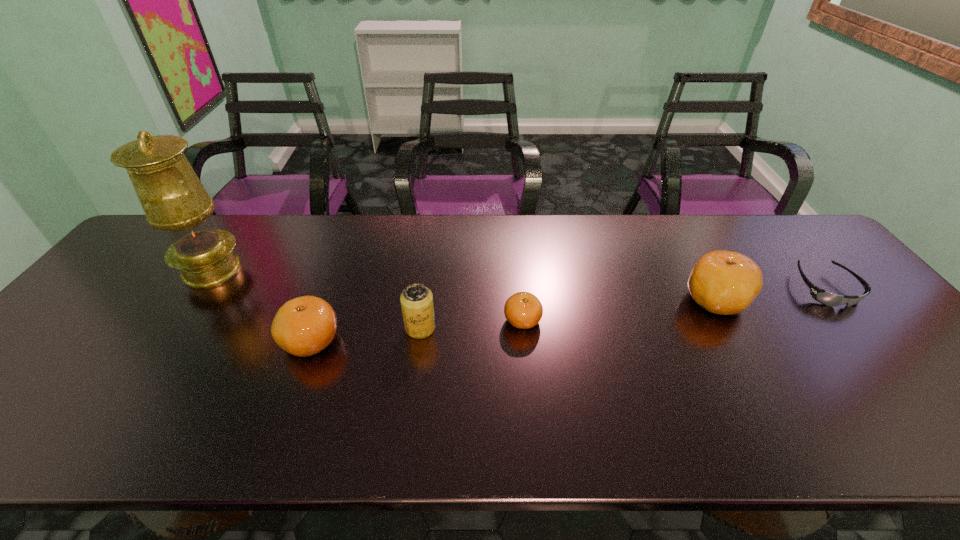
Where is `blank region between the rightmost clementine and the second clementine from left to right`? blank region between the rightmost clementine and the second clementine from left to right is located at coordinates (619, 310).

Locate which object is the fifth closest to the oil lamp. Please provide its 2D coordinates. Your answer should be formatted as a tuple, i.e. [(x, y)], where the tuple contains the x and y coordinates of a point satisfying the conditions above.

[(822, 296)]

The width and height of the screenshot is (960, 540). I want to click on object that is the fourth closest one to the leftmost clementine, so click(x=723, y=282).

You are a GUI agent. You are given a task and a screenshot of the screen. Output one action in this format:
    pyautogui.click(x=<x>, y=<y>)
    Task: Click on the second closest clementine to the fifth object from right to left
    The width and height of the screenshot is (960, 540).
    Given the screenshot: What is the action you would take?
    pyautogui.click(x=723, y=282)

At what (x,y) coordinates should I click in order to perform the action: click on the second closest clementine to the leftmost clementine. Please return your answer as a coordinate pair (x, y). Looking at the image, I should click on (723, 282).

This screenshot has height=540, width=960. I want to click on free space that satisfies the following two spatial constraints: 1. on the front side of the leftmost clementine; 2. on the left side of the leftmost object, so click(162, 341).

This screenshot has height=540, width=960. Identify the location of free space that satisfies the following two spatial constraints: 1. on the back side of the second object from left to right; 2. on the right side of the beer can. (316, 328).

This screenshot has width=960, height=540. What are the coordinates of `vacant region that satisfies the following two spatial constraints: 1. on the back side of the fourth object from right to left; 2. on the right side of the second shortest clementine` in the screenshot? It's located at pos(316,328).

The image size is (960, 540). Find the location of `free space that satisfies the following two spatial constraints: 1. on the front side of the fifth object from right to left; 2. on the right side of the oil lamp`. free space that satisfies the following two spatial constraints: 1. on the front side of the fifth object from right to left; 2. on the right side of the oil lamp is located at coordinates (162, 341).